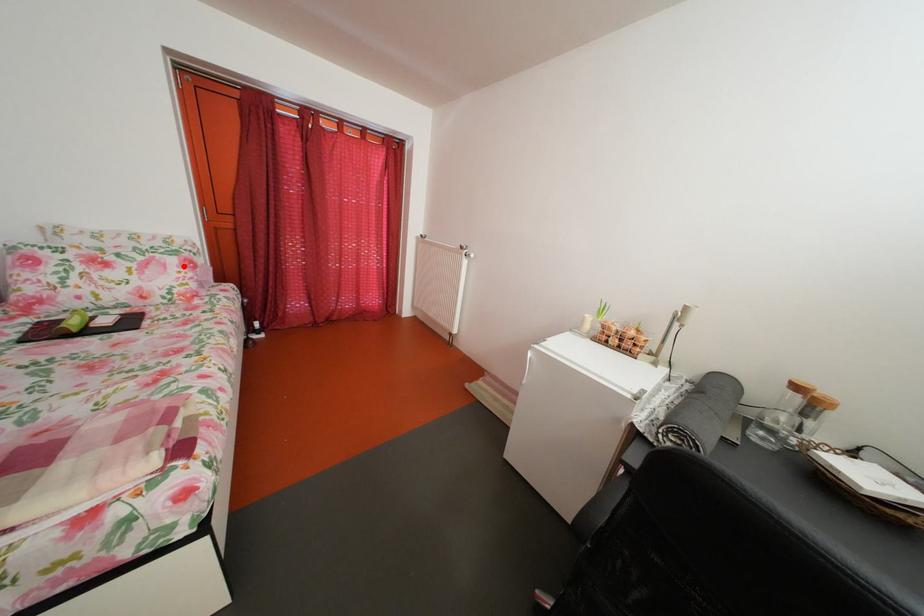
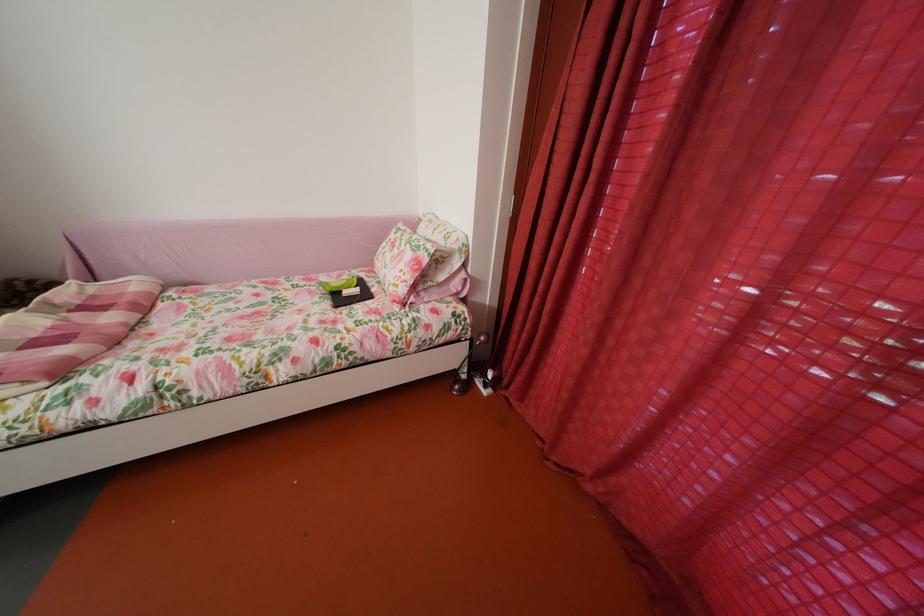
Locate, in the second image, the point that corresponds to the highlighted location in the first image.

(419, 262)